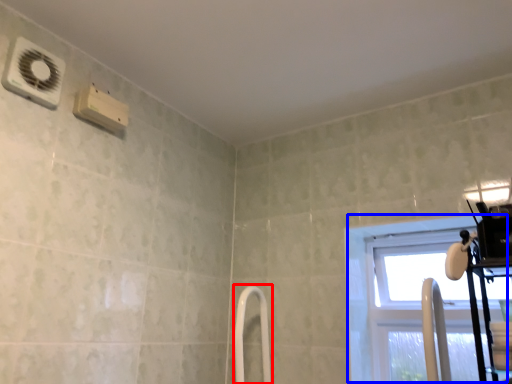
Question: Which of the following is the farthest to the observer, shower door (highlighted by a red box) or window (highlighted by a blue box)?

Choices:
 (A) shower door
 (B) window

Answer: (A)